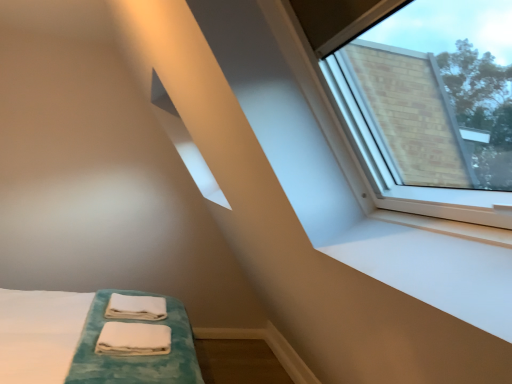
Question: From the image's perspective, is white soft towel at lower center on top of white soft towel at lower center?

Choices:
 (A) yes
 (B) no

Answer: (A)

Question: From a real-world perspective, is white soft towel at lower center positioned over white soft towel at lower center based on gravity?

Choices:
 (A) no
 (B) yes

Answer: (B)

Question: Is white soft towel at lower center further to camera compared to white soft towel at lower center?

Choices:
 (A) no
 (B) yes

Answer: (B)

Question: Is white soft towel at lower center directly adjacent to white soft towel at lower center?

Choices:
 (A) no
 (B) yes

Answer: (A)

Question: Is white soft towel at lower center taller than white soft towel at lower center?

Choices:
 (A) no
 (B) yes

Answer: (B)

Question: Is white soft towel at lower center facing away from white soft towel at lower center?

Choices:
 (A) yes
 (B) no

Answer: (B)

Question: From a real-world perspective, is white soft towel at lower center physically below white soft towel at lower center?

Choices:
 (A) yes
 (B) no

Answer: (A)

Question: Would you say white soft towel at lower center is part of white soft towel at lower center's contents?

Choices:
 (A) yes
 (B) no

Answer: (B)

Question: Is white soft towel at lower center facing towards white soft towel at lower center?

Choices:
 (A) no
 (B) yes

Answer: (A)

Question: Would you say white soft towel at lower center is outside white soft towel at lower center?

Choices:
 (A) yes
 (B) no

Answer: (A)

Question: From the image's perspective, would you say white soft towel at lower center is shown under white soft towel at lower center?

Choices:
 (A) no
 (B) yes

Answer: (B)

Question: From the image's perspective, is white soft towel at lower center located above white soft towel at lower center?

Choices:
 (A) no
 (B) yes

Answer: (A)

Question: Is point (131, 294) closer or farther from the camera than point (126, 349)?

Choices:
 (A) farther
 (B) closer

Answer: (A)